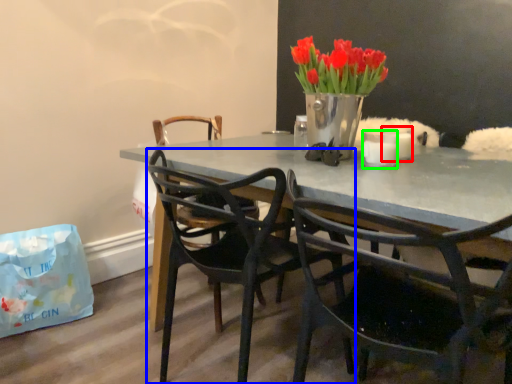
Question: Which is farther away from candle (highlighted by a red box)? chair (highlighted by a blue box) or candle (highlighted by a green box)?

Choices:
 (A) chair
 (B) candle

Answer: (A)